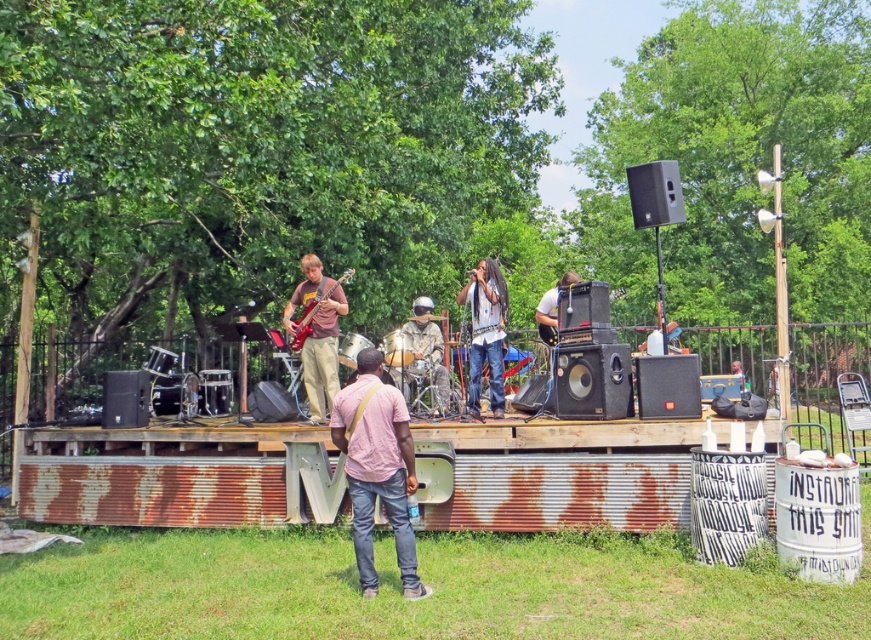
You are a stagehand standing at the center of the stage and need to reach two points marked on the stage floor. The first point is labeled as point (400, 572) and the second is point (316, 289). Which point is closer to your current position?

Point (400, 572) is closer to the viewer than point (316, 289), so the first point is closer to your current position.

You are a photographer positioned at the front of the stage. You want to take a photo that includes both the pink cotton shirt at center and the glossy electric guitar at left. Which object will appear larger in your photo?

The pink cotton shirt at center will appear larger in the photo because it is closer to the viewer than the glossy electric guitar at left.